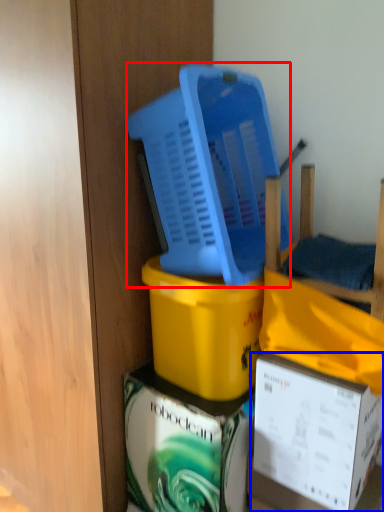
Question: Which of the following is the farthest to the observer, basket (highlighted by a red box) or box (highlighted by a blue box)?

Choices:
 (A) basket
 (B) box

Answer: (B)